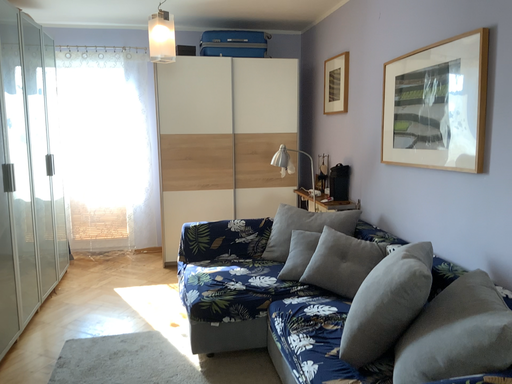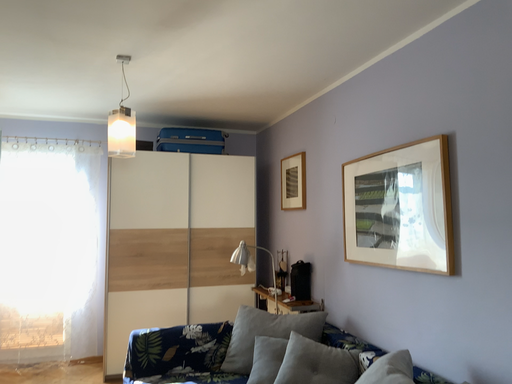
Question: How did the camera likely rotate when shooting the video?

Choices:
 (A) rotated downward
 (B) rotated upward

Answer: (B)